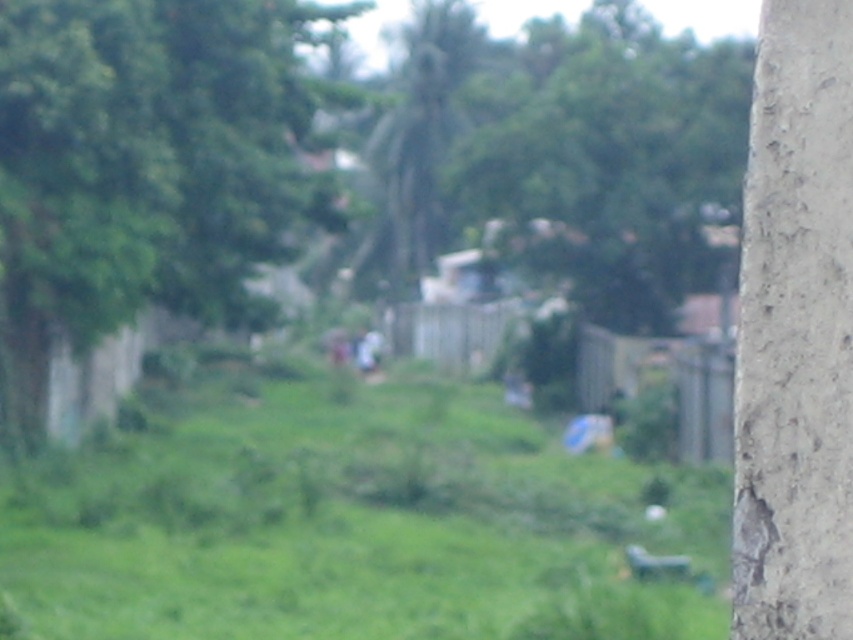
Question: Can you confirm if green grass at center is bigger than green leafy tree at upper center?

Choices:
 (A) yes
 (B) no

Answer: (B)

Question: Which is farther from the green grass at center?

Choices:
 (A) green leafy tree at center
 (B) green leafy tree at upper center

Answer: (B)

Question: Among these objects, which one is nearest to the camera?

Choices:
 (A) green leafy tree at upper center
 (B) green grass at center
 (C) gray concrete pole at right

Answer: (C)

Question: Which object appears closest to the camera in this image?

Choices:
 (A) green grass at center
 (B) green leafy tree at center

Answer: (A)

Question: Is green leafy tree at center behind green leafy tree at upper center?

Choices:
 (A) no
 (B) yes

Answer: (B)

Question: Can you confirm if green leafy tree at center is positioned above green leafy tree at upper center?

Choices:
 (A) yes
 (B) no

Answer: (A)